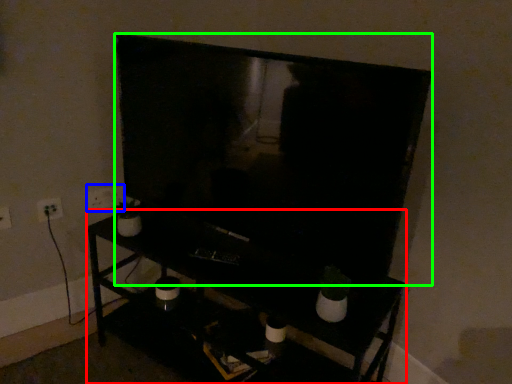
Question: Which is nearer to the furniture (highlighted by a red box)? electric outlet (highlighted by a blue box) or television (highlighted by a green box).

Choices:
 (A) electric outlet
 (B) television

Answer: (B)